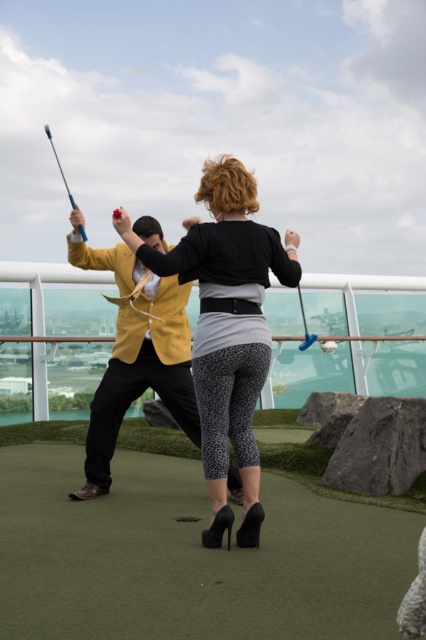
Does yellow fabric jacket at left appear over blue plastic fishing pole at upper left?

Actually, yellow fabric jacket at left is below blue plastic fishing pole at upper left.

Can you confirm if yellow fabric jacket at left is positioned below blue plastic fishing pole at upper left?

Yes.

Between point (115, 416) and point (45, 131), which one is positioned in front?

Point (115, 416) is in front.

Find the location of a particular element. The height and width of the screenshot is (640, 426). yellow fabric jacket at left is located at coordinates (135, 355).

Looking at this image, is the position of green artificial turf at center less distant than that of blue plastic fishing pole at upper left?

Yes, it is in front of blue plastic fishing pole at upper left.

Is point (2, 449) less distant than point (80, 227)?

No, (2, 449) is further to viewer.

Identify the location of green artificial turf at center. (190, 547).

Between black textured leggings at center and yellow fabric jacket at left, which one appears on the left side from the viewer's perspective?

From the viewer's perspective, yellow fabric jacket at left appears more on the left side.

Does black textured leggings at center appear on the right side of yellow fabric jacket at left?

Indeed, black textured leggings at center is positioned on the right side of yellow fabric jacket at left.

The width and height of the screenshot is (426, 640). What do you see at coordinates (227, 328) in the screenshot? I see `black textured leggings at center` at bounding box center [227, 328].

Locate an element on the screen. black textured leggings at center is located at coordinates tap(227, 328).